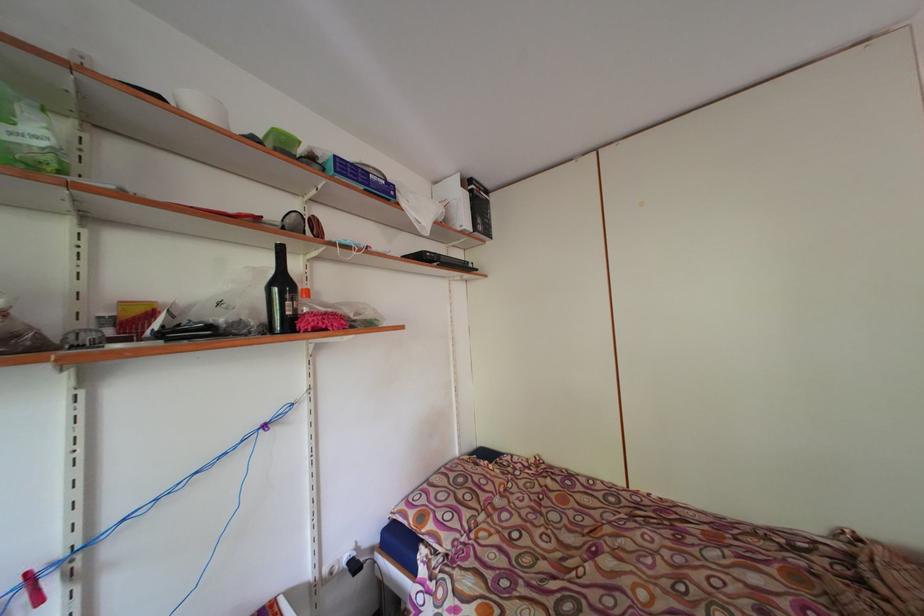
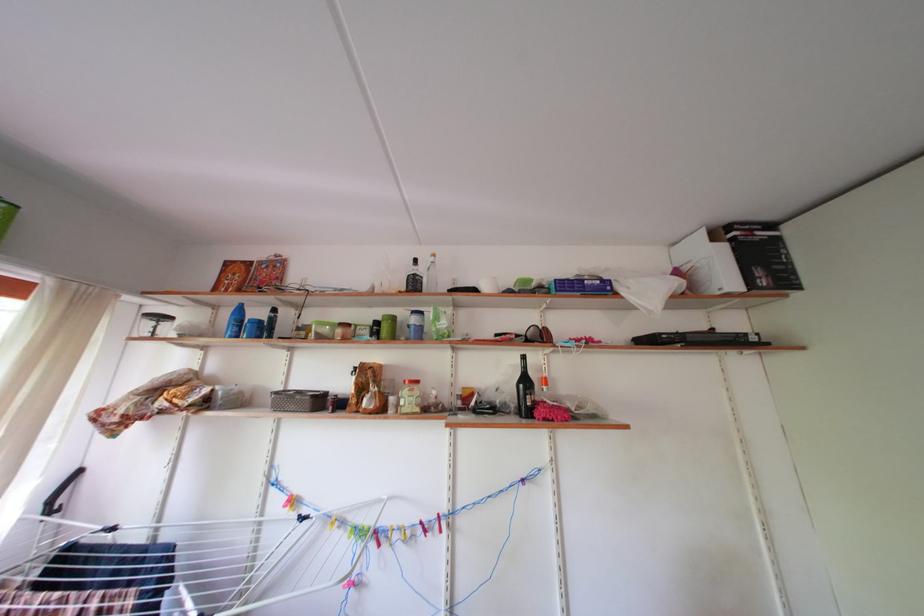
Find the pixel in the second image that matches (488,228) in the first image.

(768, 278)